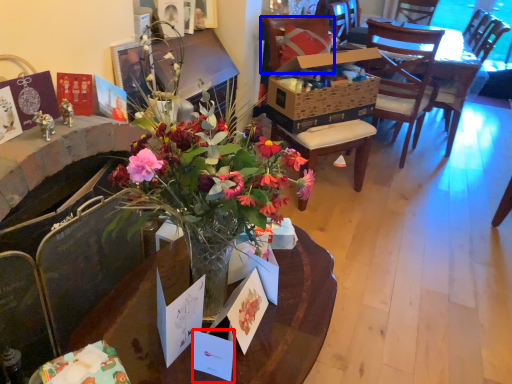
Question: Which point is closer to the camera, postcard (highlighted by a red box) or chair (highlighted by a blue box)?

Choices:
 (A) postcard
 (B) chair

Answer: (A)